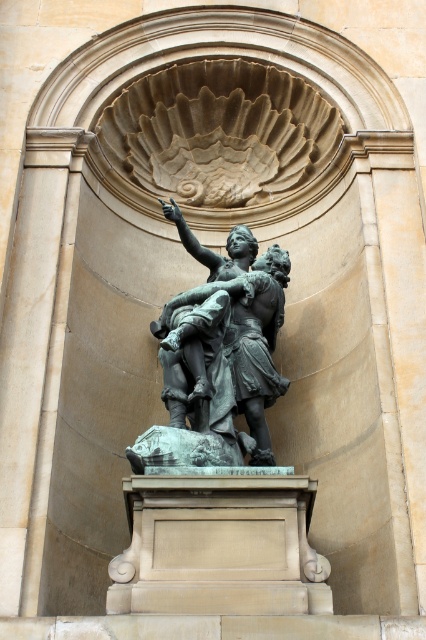
You are an art conservator assessing the space for maintenance. The bronze statue at center and the smooth beige stone pillar at center are both in need of cleaning. Given their sizes, which object requires a taller ladder to reach its highest point?

The bronze statue at center is larger in size than the smooth beige stone pillar at center, so the bronze statue at center requires a taller ladder to reach its highest point.

You are an art conservator assessing the placement of the bronze statue at center and the smooth beige stone pillar at center. Based on their heights, which object would require a taller ladder to reach its top for maintenance?

The smooth beige stone pillar at center requires a taller ladder since it is taller than the bronze statue at center.

You are an art conservator assessing the space between the bronze statue at center and the smooth beige stone pillar at center. Based on their widths, can you determine if there is enough space to safely move a 1.2 meter wide crate between them?

The bronze statue at center might be wider than smooth beige stone pillar at center. If the statue is indeed wider, the total width required for the crate may exceed the available space. Without exact measurements, it is uncertain whether the 1.2 meter wide crate can safely pass between them.